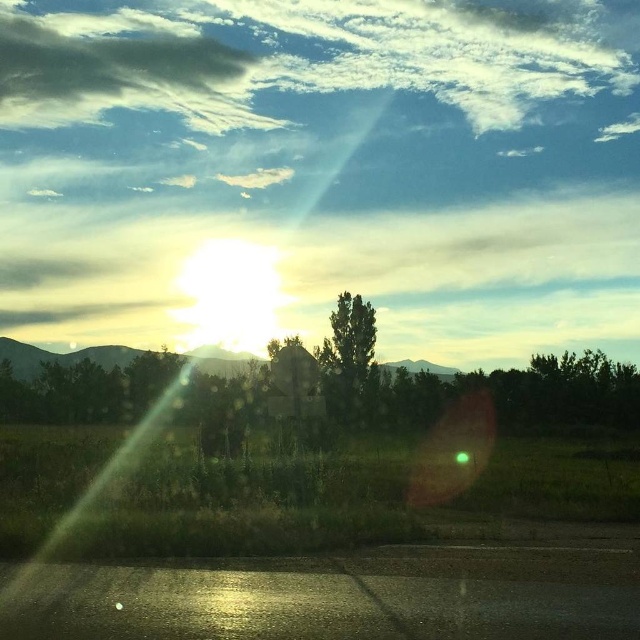
Question: Is green leafy tree at center positioned behind green matte tree at center?

Choices:
 (A) yes
 (B) no

Answer: (B)

Question: Which point appears farthest from the camera in this image?

Choices:
 (A) (346, 349)
 (B) (220, 376)

Answer: (B)

Question: Does green leafy tree at center have a smaller size compared to green matte tree at center?

Choices:
 (A) yes
 (B) no

Answer: (B)

Question: Is green leafy tree at center further to camera compared to green matte tree at center?

Choices:
 (A) yes
 (B) no

Answer: (B)